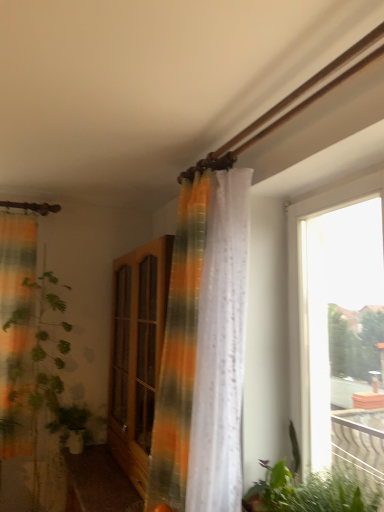
From the picture: What is the approximate height of wooden cabinet at center?

wooden cabinet at center is 19.35 inches tall.

What is the approximate width of green matte plant at lower left, which is counted as the first vegetation, starting from the back?

It is 12.95 inches.

What do you see at coordinates (72, 426) in the screenshot? I see `green matte plant at lower left, which appears as the first vegetation when viewed from the left` at bounding box center [72, 426].

Image resolution: width=384 pixels, height=512 pixels. What are the coordinates of `green leafy plant at lower right, the 1th vegetation viewed from the top` in the screenshot? It's located at (309, 492).

Describe the element at coordinates (309, 492) in the screenshot. I see `green leafy plant at lower right, the 2th vegetation from the back` at that location.

This screenshot has height=512, width=384. What do you see at coordinates (203, 350) in the screenshot? I see `translucent orange-green curtain at center` at bounding box center [203, 350].

The height and width of the screenshot is (512, 384). I want to click on translucent orange-green curtain at center, so click(x=203, y=350).

This screenshot has height=512, width=384. What do you see at coordinates (305, 294) in the screenshot?
I see `transparent glass window at right` at bounding box center [305, 294].

Locate an element on the screen. wooden cabinet at center is located at coordinates (98, 483).

Is transparent glass window at right at the left side of wooden cabinet at center?

Incorrect, transparent glass window at right is not on the left side of wooden cabinet at center.

Does transparent glass window at right turn towards wooden cabinet at center?

No, transparent glass window at right is not turned towards wooden cabinet at center.

Considering the points (329, 195) and (115, 354), which point is behind, point (329, 195) or point (115, 354)?

The point (115, 354) is farther.

Which is in front, point (120, 406) or point (92, 457)?

The point (92, 457) is closer to the camera.

Image resolution: width=384 pixels, height=512 pixels. What are the coordinates of `screen door positioned vertically above the wooden cabinet at center (from a real-world perspective)` in the screenshot? It's located at (137, 353).

From the image's perspective, does wooden cabinet at center appear higher than wooden cabinet at center?

Yes, from the image's perspective, wooden cabinet at center is over wooden cabinet at center.

Can you confirm if wooden cabinet at center is taller than wooden cabinet at center?

Indeed, wooden cabinet at center has a greater height compared to wooden cabinet at center.

From the image's perspective, who appears lower, wooden cabinet at center or transparent glass window at right?

wooden cabinet at center, from the image's perspective.

From a real-world perspective, who is located higher, wooden cabinet at center or transparent glass window at right?

From a 3D spatial view, transparent glass window at right is above.

Identify the location of window above the wooden cabinet at center (from the image's perspective). This screenshot has width=384, height=512. (305, 294).

Is wooden cabinet at center facing towards transparent glass window at right?

No, wooden cabinet at center is not oriented towards transparent glass window at right.

Looking at this image, from a real-world perspective, between wooden cabinet at center and transparent glass window at right, who is vertically higher?

In real-world perspective, transparent glass window at right is above.

Is transparent glass window at right at the back of wooden cabinet at center?

wooden cabinet at center is not turned away from transparent glass window at right.

From the image's perspective, which one is positioned higher, wooden cabinet at center or transparent glass window at right?

From the image's view, transparent glass window at right is above.

Who is more distant, wooden cabinet at center or translucent orange-green curtain at center?

Positioned behind is wooden cabinet at center.

Is wooden cabinet at center positioned beyond the bounds of translucent orange-green curtain at center?

wooden cabinet at center is positioned outside translucent orange-green curtain at center.

Are wooden cabinet at center and translucent orange-green curtain at center located far from each other?

wooden cabinet at center is actually quite close to translucent orange-green curtain at center.

Can you tell me how much wooden cabinet at center and translucent orange-green curtain at center differ in facing direction?

There is a 0.000648-degree angle between the facing directions of wooden cabinet at center and translucent orange-green curtain at center.

Between green leafy plant at lower right, the 2th vegetation from the back, and wooden cabinet at center, which one has larger size?

wooden cabinet at center.

Image resolution: width=384 pixels, height=512 pixels. I want to click on screen door above the green leafy plant at lower right, the 2th vegetation from the back (from the image's perspective), so click(137, 353).

Is wooden cabinet at center aimed at green matte plant at lower left, arranged as the 2th vegetation when viewed from the front?

No, wooden cabinet at center is not aimed at green matte plant at lower left, arranged as the 2th vegetation when viewed from the front.

Find the location of a particular element. The width and height of the screenshot is (384, 512). furniture below the green matte plant at lower left, which appears as the 1th vegetation when ordered from the bottom (from the image's perspective) is located at coordinates point(98,483).

Can we say wooden cabinet at center lies outside green matte plant at lower left, which appears as the 1th vegetation when ordered from the bottom?

wooden cabinet at center is positioned outside green matte plant at lower left, which appears as the 1th vegetation when ordered from the bottom.

Image resolution: width=384 pixels, height=512 pixels. Identify the location of window on the right of wooden cabinet at center. (305, 294).

Identify the location of furniture in front of the wooden cabinet at center. This screenshot has height=512, width=384. (98, 483).

Based on their spatial positions, is translucent orange-green curtain at center or wooden cabinet at center further from transparent glass window at right?

wooden cabinet at center.

Estimate the real-world distances between objects in this image. Which object is closer to green matte plant at lower left, arranged as the 2th vegetation when viewed from the front, wooden cabinet at center or translucent orange-green curtain at center?

wooden cabinet at center.

From the image, which object appears to be nearer to wooden cabinet at center, wooden cabinet at center or green leafy plant at lower right, marked as the 1th vegetation in a front-to-back arrangement?

wooden cabinet at center is closer to wooden cabinet at center.

When comparing their distances from wooden cabinet at center, does green matte plant at lower left, acting as the second vegetation starting from the top, or transparent glass window at right seem closer?

Among the two, green matte plant at lower left, acting as the second vegetation starting from the top, is located nearer to wooden cabinet at center.

When comparing their distances from transparent glass window at right, does wooden cabinet at center or green leafy plant at lower right, marked as the 1th vegetation in a front-to-back arrangement, seem closer?

Among the two, green leafy plant at lower right, marked as the 1th vegetation in a front-to-back arrangement, is located nearer to transparent glass window at right.

Estimate the real-world distances between objects in this image. Which object is closer to green matte plant at lower left, which is counted as the first vegetation, starting from the back, translucent orange-green curtain at center or wooden cabinet at center?

wooden cabinet at center.

Considering their positions, is wooden cabinet at center positioned closer to translucent orange-green curtain at center than green matte plant at lower left, which appears as the first vegetation when viewed from the left?

Among the two, wooden cabinet at center is located nearer to translucent orange-green curtain at center.

Estimate the real-world distances between objects in this image. Which object is further from translucent orange-green curtain at center, green leafy plant at lower right, the 2th vegetation from the back, or wooden cabinet at center?

wooden cabinet at center.

Where is `screen door between green matte plant at lower left, the 2th vegetation when ordered from right to left, and transparent glass window at right, in the horizontal direction`? This screenshot has width=384, height=512. screen door between green matte plant at lower left, the 2th vegetation when ordered from right to left, and transparent glass window at right, in the horizontal direction is located at coordinates (x=137, y=353).

Locate an element on the screen. vegetation situated between wooden cabinet at center and transparent glass window at right from left to right is located at coordinates (309, 492).

Identify the location of screen door between translucent orange-green curtain at center and green matte plant at lower left, which appears as the first vegetation when viewed from the left, along the z-axis. This screenshot has width=384, height=512. click(x=137, y=353).

In order to click on screen door that lies between translucent orange-green curtain at center and wooden cabinet at center from top to bottom in this screenshot , I will do `click(137, 353)`.